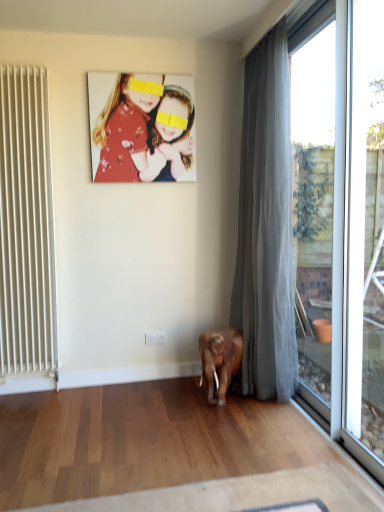
Find the location of a particular element. The width and height of the screenshot is (384, 512). vacant area to the right of white matte radiator at left is located at coordinates (75, 392).